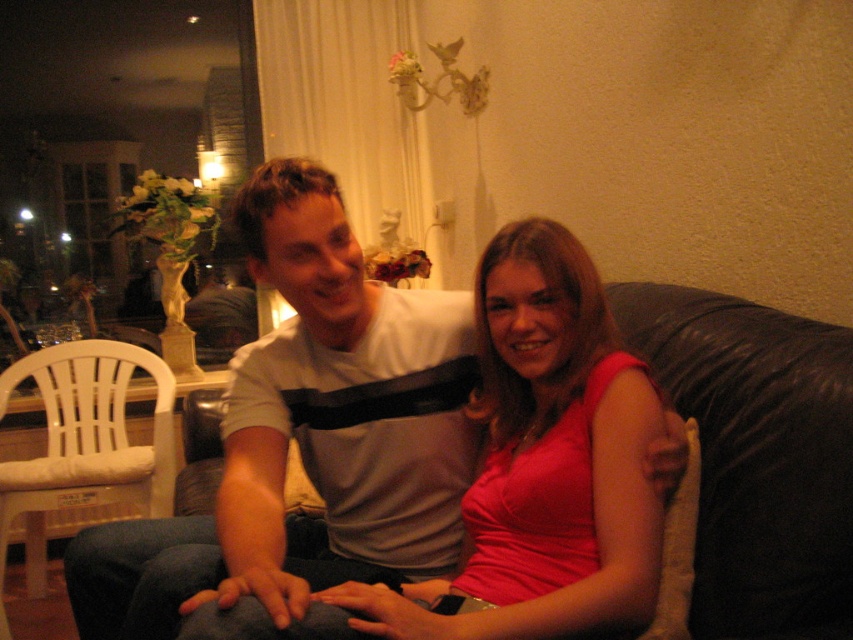
Question: Which object is the closest to the black leather couch at center?

Choices:
 (A) gray striped t-shirt at center
 (B) white plastic chair at left

Answer: (A)

Question: Based on their relative distances, which object is nearer to the white plastic chair at left?

Choices:
 (A) gray striped t-shirt at center
 (B) black leather couch at center

Answer: (A)

Question: Can you confirm if black leather couch at center is positioned below white plastic chair at left?

Choices:
 (A) no
 (B) yes

Answer: (A)

Question: Does gray striped t-shirt at center appear under white plastic chair at left?

Choices:
 (A) no
 (B) yes

Answer: (A)

Question: Which point appears farthest from the camera in this image?

Choices:
 (A) (782, 481)
 (B) (283, 515)
 (C) (78, 353)

Answer: (C)

Question: Is black leather couch at center to the left of white plastic chair at left from the viewer's perspective?

Choices:
 (A) no
 (B) yes

Answer: (A)